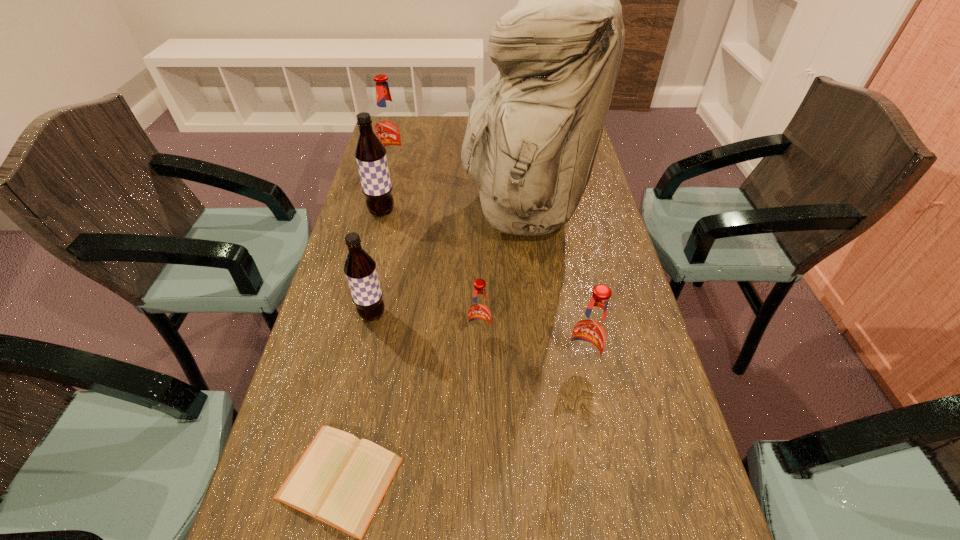
This screenshot has height=540, width=960. Identify the location of root beer that is positioned at the right edge. (590, 333).

In the image, there is a desktop. Identify the location of vacant region at the left edge. This screenshot has width=960, height=540. (366, 234).

The height and width of the screenshot is (540, 960). In order to click on vacant position at the right edge of the desktop in this screenshot , I will do `click(576, 278)`.

The width and height of the screenshot is (960, 540). In order to click on unoccupied position between the smaller brown root beer and the leftmost red root beer in this screenshot , I will do (384, 241).

Find the location of `free space between the fourth nearest object and the tallest object`. free space between the fourth nearest object and the tallest object is located at coordinates (448, 262).

You are a GUI agent. You are given a task and a screenshot of the screen. Output one action in this format:
    pyautogui.click(x=<x>, y=<y>)
    Task: Click on the empty location between the tallest object and the nearer brown root beer
    Image resolution: width=960 pixels, height=540 pixels.
    Given the screenshot: What is the action you would take?
    pyautogui.click(x=448, y=262)

Where is `vacant area that lies between the nearer brown root beer and the leftmost red root beer`? The height and width of the screenshot is (540, 960). vacant area that lies between the nearer brown root beer and the leftmost red root beer is located at coordinates (384, 241).

This screenshot has height=540, width=960. Find the location of `object that can be found as the third closest to the bigger brown root beer`. object that can be found as the third closest to the bigger brown root beer is located at coordinates (360, 269).

This screenshot has width=960, height=540. Find the location of `the fourth closest object to the shortest object`. the fourth closest object to the shortest object is located at coordinates (533, 131).

Locate which root beer ranks fourth in proximity to the tallest object. Please provide its 2D coordinates. Your answer should be formatted as a tuple, i.e. [(x, y)], where the tuple contains the x and y coordinates of a point satisfying the conditions above.

[(360, 269)]